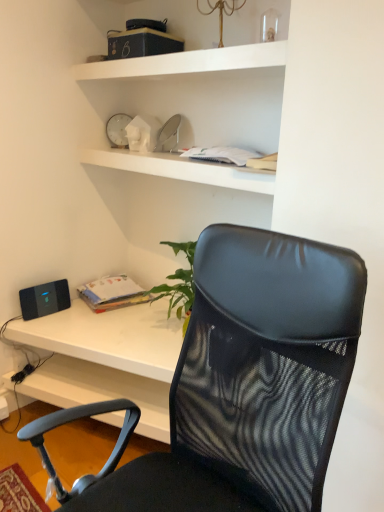
Locate an element on the screen. This screenshot has height=512, width=384. vacant area located to the right-hand side of matte paper book at center is located at coordinates (144, 311).